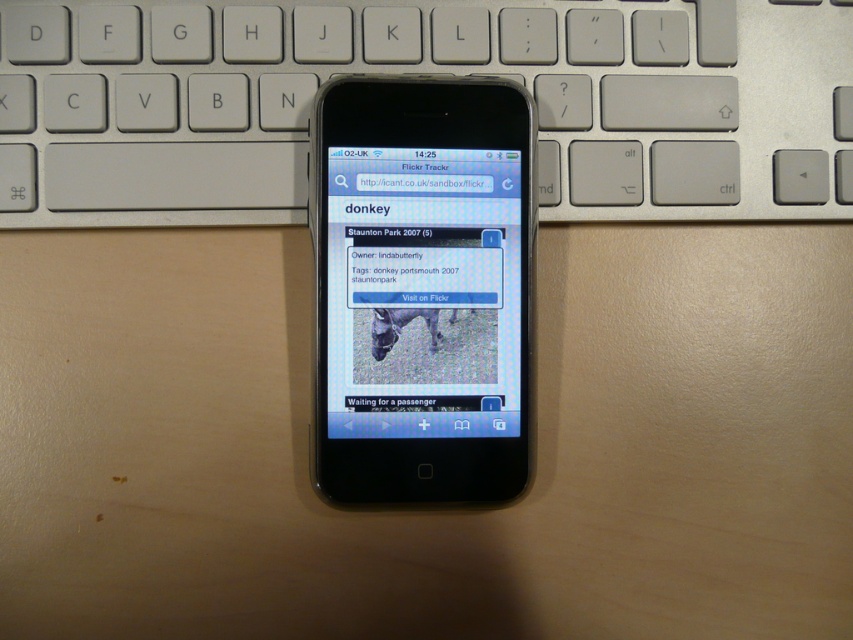
Is point (25, 156) in front of point (418, 388)?

No, (25, 156) is behind (418, 388).

Where is `silver metallic keyboard at center`? The width and height of the screenshot is (853, 640). silver metallic keyboard at center is located at coordinates (426, 72).